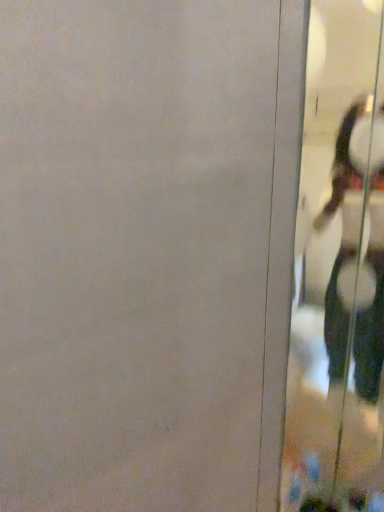
What is the approximate width of white glossy shoes at right?

It is 0.67 inches.

The height and width of the screenshot is (512, 384). Describe the element at coordinates (370, 333) in the screenshot. I see `white glossy shoes at right` at that location.

Where is `white glossy shoes at right`? Image resolution: width=384 pixels, height=512 pixels. white glossy shoes at right is located at coordinates (370, 333).

Where is `transparent glass screen door at right`? Image resolution: width=384 pixels, height=512 pixels. transparent glass screen door at right is located at coordinates (339, 273).

Describe the element at coordinates (339, 273) in the screenshot. I see `transparent glass screen door at right` at that location.

Identify the location of white glossy shoes at right. (370, 333).

From the picture: Which object is positioned more to the right, white glossy shoes at right or transparent glass screen door at right?

Positioned to the right is white glossy shoes at right.

Which object is closer to the camera taking this photo, white glossy shoes at right or transparent glass screen door at right?

Positioned in front is transparent glass screen door at right.

Which point is more distant from viewer, [351,177] or [362,254]?

The point [362,254] is farther from the camera.

From the image's perspective, is white glossy shoes at right located above transparent glass screen door at right?

No, from the image's perspective, white glossy shoes at right is not on top of transparent glass screen door at right.

From the picture: From a real-world perspective, is white glossy shoes at right physically located above or below transparent glass screen door at right?

white glossy shoes at right is situated lower than transparent glass screen door at right in the real world.

Is white glossy shoes at right wider or thinner than transparent glass screen door at right?

white glossy shoes at right is wider than transparent glass screen door at right.

Considering the sizes of objects white glossy shoes at right and transparent glass screen door at right in the image provided, who is taller, white glossy shoes at right or transparent glass screen door at right?

With more height is transparent glass screen door at right.

Between white glossy shoes at right and transparent glass screen door at right, which one has larger size?

transparent glass screen door at right is bigger.

Would you say white glossy shoes at right is inside or outside transparent glass screen door at right?

white glossy shoes at right is spatially situated outside transparent glass screen door at right.

Are white glossy shoes at right and transparent glass screen door at right beside each other?

No, white glossy shoes at right is not with transparent glass screen door at right.

Could you tell me if white glossy shoes at right is turned towards transparent glass screen door at right?

Yes.

How many degrees apart are the facing directions of white glossy shoes at right and transparent glass screen door at right?

89.5 degrees.

In order to click on screen door that appears in front of the white glossy shoes at right in this screenshot , I will do `click(339, 273)`.

Does transparent glass screen door at right appear on the left side of white glossy shoes at right?

Indeed, transparent glass screen door at right is positioned on the left side of white glossy shoes at right.

Which object is closer to the camera, transparent glass screen door at right or white glossy shoes at right?

transparent glass screen door at right is in front.

Is point (314, 215) farther from viewer compared to point (380, 183)?

That is True.

From the image's perspective, which is above, transparent glass screen door at right or white glossy shoes at right?

transparent glass screen door at right, from the image's perspective.

From a real-world perspective, is transparent glass screen door at right physically located above or below white glossy shoes at right?

transparent glass screen door at right is situated higher than white glossy shoes at right in the real world.

Is transparent glass screen door at right thinner than white glossy shoes at right?

Indeed, transparent glass screen door at right has a lesser width compared to white glossy shoes at right.

Is transparent glass screen door at right shorter than white glossy shoes at right?

No, transparent glass screen door at right is not shorter than white glossy shoes at right.

Is transparent glass screen door at right bigger than white glossy shoes at right?

Correct, transparent glass screen door at right is larger in size than white glossy shoes at right.

Is transparent glass screen door at right positioned beyond the bounds of white glossy shoes at right?

Absolutely, transparent glass screen door at right is external to white glossy shoes at right.

Would you consider transparent glass screen door at right to be distant from white glossy shoes at right?

No, transparent glass screen door at right is in close proximity to white glossy shoes at right.

Does transparent glass screen door at right turn towards white glossy shoes at right?

Yes, transparent glass screen door at right faces towards white glossy shoes at right.

At what (x,y) coordinates should I click in order to perform the action: click on person on the right of transparent glass screen door at right. Please return your answer as a coordinate pair (x, y). The width and height of the screenshot is (384, 512). Looking at the image, I should click on (370, 333).

At what (x,y) coordinates should I click in order to perform the action: click on person located below the transparent glass screen door at right (from the image's perspective). Please return your answer as a coordinate pair (x, y). Looking at the image, I should click on (370, 333).

At what (x,y) coordinates should I click in order to perform the action: click on screen door that appears above the white glossy shoes at right (from the image's perspective). Please return your answer as a coordinate pair (x, y). Looking at the image, I should click on (339, 273).